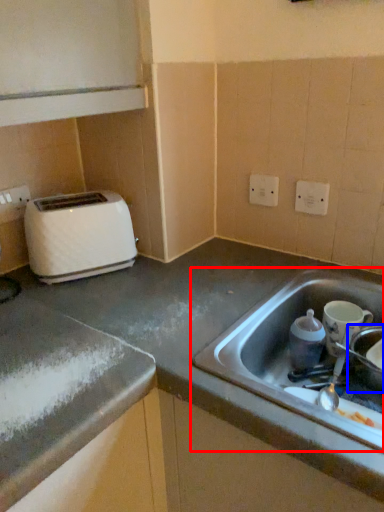
Question: Which point is further to the camera, sink (highlighted by a red box) or appliance (highlighted by a blue box)?

Choices:
 (A) sink
 (B) appliance

Answer: (B)